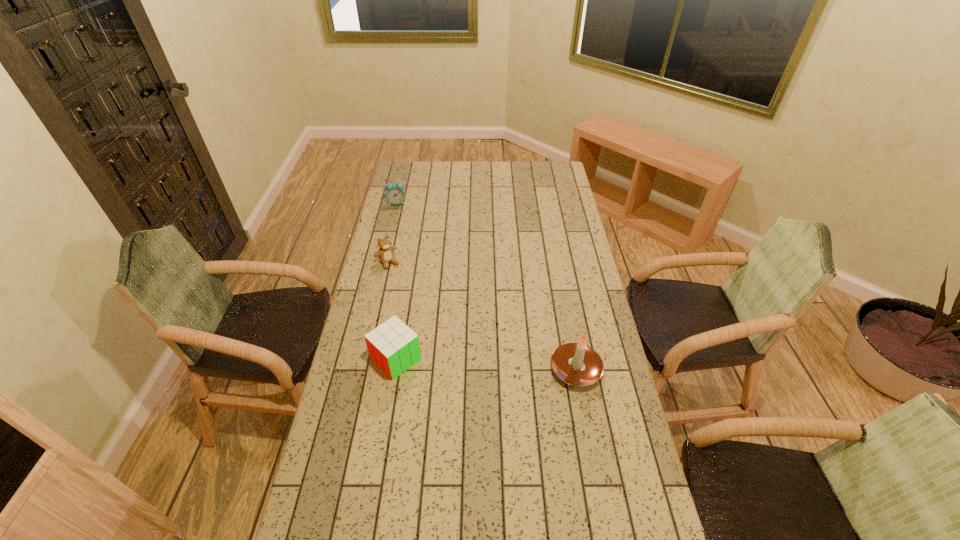
This screenshot has height=540, width=960. Find the location of `cube`. cube is located at coordinates (393, 346).

The image size is (960, 540). Find the location of `the rightmost object`. the rightmost object is located at coordinates (576, 364).

This screenshot has width=960, height=540. I want to click on candle, so click(x=576, y=364).

Find the location of `teddy bear`. teddy bear is located at coordinates point(385,253).

The image size is (960, 540). In order to click on alarm clock in this screenshot , I will do `click(395, 194)`.

Locate an element on the screen. The image size is (960, 540). free location located 0.080m on the left of the cube is located at coordinates (348, 359).

Locate an element on the screen. The height and width of the screenshot is (540, 960). free space located on the back of the tallest object is located at coordinates (563, 301).

Identify the location of vacant area situated on the front-facing side of the second farthest object. (430, 317).

Locate an element on the screen. The height and width of the screenshot is (540, 960). free region located 0.290m on the front-facing side of the second farthest object is located at coordinates (426, 312).

This screenshot has height=540, width=960. Find the location of `free space located 0.340m on the front-facing side of the second farthest object`. free space located 0.340m on the front-facing side of the second farthest object is located at coordinates (433, 320).